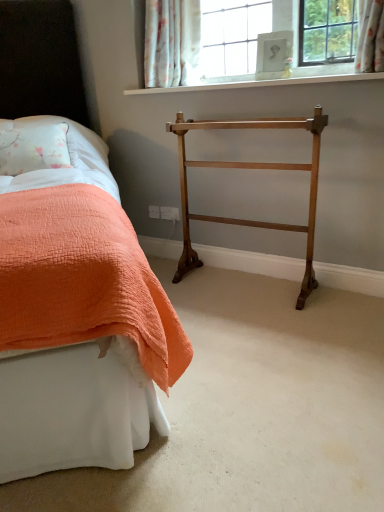
What do you see at coordinates (267, 81) in the screenshot? The height and width of the screenshot is (512, 384). I see `white painted wood at upper center` at bounding box center [267, 81].

Locate an element on the screen. This screenshot has width=384, height=512. polished brass towel rack at center is located at coordinates (250, 168).

The image size is (384, 512). What do you see at coordinates (78, 318) in the screenshot? I see `orange quilted bed at left` at bounding box center [78, 318].

What do you see at coordinates (172, 42) in the screenshot? The width and height of the screenshot is (384, 512). I see `floral fabric curtain at upper center` at bounding box center [172, 42].

Where is `white quilted fabric at left`? This screenshot has height=512, width=384. white quilted fabric at left is located at coordinates (52, 155).

Looking at this image, is floral fabric curtain at upper center inside white painted wood at upper center?

No, floral fabric curtain at upper center is not surrounded by white painted wood at upper center.

Is white painted wood at upper center shorter than floral fabric curtain at upper center?

Correct, white painted wood at upper center is not as tall as floral fabric curtain at upper center.

How far apart are white painted wood at upper center and floral fabric curtain at upper center?

white painted wood at upper center and floral fabric curtain at upper center are 12.30 inches apart from each other.

Is white painted wood at upper center positioned in front of floral fabric curtain at upper center?

Yes, it is in front of floral fabric curtain at upper center.

How much distance is there between floral fabric curtain at upper center and orange quilted bed at left?

floral fabric curtain at upper center and orange quilted bed at left are 95.64 centimeters apart from each other.

Consider the image. Can you confirm if floral fabric curtain at upper center is thinner than orange quilted bed at left?

Indeed, floral fabric curtain at upper center has a lesser width compared to orange quilted bed at left.

Which is nearer, [181,17] or [8,418]?

Point [181,17].

Identify the location of bed in front of the floral fabric curtain at upper center. The image size is (384, 512). (78, 318).

In the scene shown: Is orange quilted bed at left to the left of white painted wood at upper center from the viewer's perspective?

Indeed, orange quilted bed at left is positioned on the left side of white painted wood at upper center.

Is orange quilted bed at left placed right next to white painted wood at upper center?

orange quilted bed at left and white painted wood at upper center are clearly separated.

Who is more distant, orange quilted bed at left or white painted wood at upper center?

white painted wood at upper center is further away from the camera.

Which object is more forward, white painted wood at upper center or white quilted fabric at left?

Positioned in front is white painted wood at upper center.

Would you say white quilted fabric at left is part of white painted wood at upper center's contents?

No, white quilted fabric at left is not surrounded by white painted wood at upper center.

Which point is more distant from viewer, (305, 80) or (32, 172)?

The point (305, 80) is behind.

Would you say polished brass towel rack at center is a long distance from floral fabric curtain at upper center?

No, polished brass towel rack at center is in close proximity to floral fabric curtain at upper center.

Considering the positions of points (218, 165) and (165, 10), is point (218, 165) farther from camera compared to point (165, 10)?

No, (218, 165) is in front of (165, 10).

From a real-world perspective, is polished brass towel rack at center on floral fabric curtain at upper center?

No, from a real-world perspective, polished brass towel rack at center is not above floral fabric curtain at upper center.

Which is more to the right, polished brass towel rack at center or floral fabric curtain at upper center?

polished brass towel rack at center is more to the right.

Can we say polished brass towel rack at center lies outside white quilted fabric at left?

That's correct, polished brass towel rack at center is outside of white quilted fabric at left.

Where is `furniture below the white quilted fabric at left (from a real-world perspective)`? The image size is (384, 512). furniture below the white quilted fabric at left (from a real-world perspective) is located at coordinates click(250, 168).

Is polished brass towel rack at center positioned before white quilted fabric at left?

Yes, polished brass towel rack at center is closer to the viewer.

From a real-world perspective, which object rests below the other?

orange quilted bed at left, from a real-world perspective.

In the image, is white quilted fabric at left on the left side or the right side of orange quilted bed at left?

Clearly, white quilted fabric at left is on the left of orange quilted bed at left in the image.

Considering the sizes of objects white quilted fabric at left and orange quilted bed at left in the image provided, who is smaller, white quilted fabric at left or orange quilted bed at left?

With smaller size is white quilted fabric at left.

The width and height of the screenshot is (384, 512). I want to click on curtain above the white painted wood at upper center (from the image's perspective), so coord(172,42).

Identify the location of bed that appears below the floral fabric curtain at upper center (from the image's perspective). (78, 318).

Based on their spatial positions, is orange quilted bed at left or white quilted fabric at left further from white painted wood at upper center?

orange quilted bed at left lies further to white painted wood at upper center than the other object.

When comparing their distances from floral fabric curtain at upper center, does white quilted fabric at left or polished brass towel rack at center seem further?

white quilted fabric at left.

Considering their positions, is polished brass towel rack at center positioned further to white quilted fabric at left than floral fabric curtain at upper center?

Among the two, floral fabric curtain at upper center is located further to white quilted fabric at left.

Which object lies further to the anchor point white painted wood at upper center, floral fabric curtain at upper center or orange quilted bed at left?

orange quilted bed at left.

Which object lies further to the anchor point orange quilted bed at left, polished brass towel rack at center or floral fabric curtain at upper center?

The object further to orange quilted bed at left is floral fabric curtain at upper center.

When comparing their distances from polished brass towel rack at center, does white painted wood at upper center or floral fabric curtain at upper center seem closer?

Among the two, white painted wood at upper center is located nearer to polished brass towel rack at center.

Which object lies nearer to the anchor point white painted wood at upper center, white quilted fabric at left or polished brass towel rack at center?

Among the two, polished brass towel rack at center is located nearer to white painted wood at upper center.

Estimate the real-world distances between objects in this image. Which object is closer to polished brass towel rack at center, orange quilted bed at left or white painted wood at upper center?

white painted wood at upper center lies closer to polished brass towel rack at center than the other object.

Where is `window sill between floral fabric curtain at upper center and polished brass towel rack at center from top to bottom`? window sill between floral fabric curtain at upper center and polished brass towel rack at center from top to bottom is located at coordinates (267, 81).

The width and height of the screenshot is (384, 512). I want to click on furniture between white quilted fabric at left and white painted wood at upper center from left to right, so (x=250, y=168).

Where is `window sill located between orange quilted bed at left and floral fabric curtain at upper center in the depth direction`? The height and width of the screenshot is (512, 384). window sill located between orange quilted bed at left and floral fabric curtain at upper center in the depth direction is located at coordinates (267, 81).

Image resolution: width=384 pixels, height=512 pixels. What are the coordinates of `furniture between orange quilted bed at left and white quilted fabric at left from front to back` in the screenshot? It's located at (250, 168).